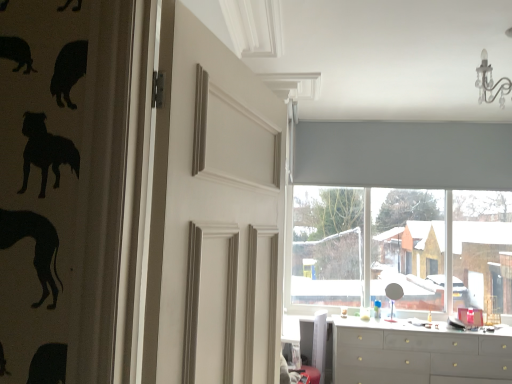
Question: In terms of height, does matte gray dresser at lower right look taller or shorter compared to matte gray roller blind at upper center?

Choices:
 (A) short
 (B) tall

Answer: (A)

Question: In the image, is matte gray dresser at lower right on the left side or the right side of matte gray roller blind at upper center?

Choices:
 (A) left
 (B) right

Answer: (B)

Question: Estimate the real-world distances between objects in this image. Which object is farther from the white matte door at center?

Choices:
 (A) matte gray roller blind at upper center
 (B) gray fabric curtain at upper center
 (C) matte gray dresser at lower right
 (D) white glossy counter top at lower center

Answer: (B)

Question: Which of these objects is positioned closest to the matte gray roller blind at upper center?

Choices:
 (A) gray fabric curtain at upper center
 (B) white matte door at center
 (C) matte gray dresser at lower right
 (D) white glossy counter top at lower center

Answer: (A)